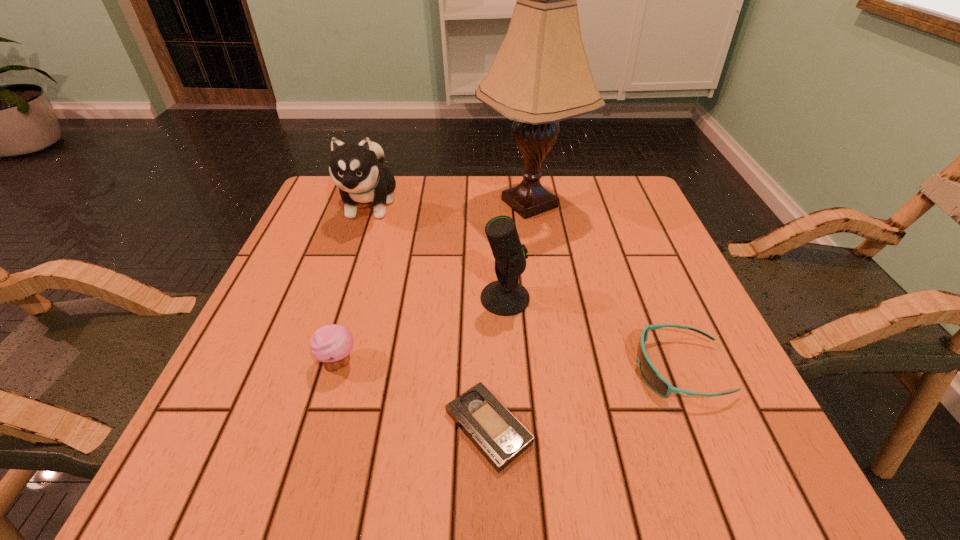
Locate an element on the screen. This screenshot has width=960, height=540. free space located 0.070m on the front-facing side of the second shortest object is located at coordinates (594, 369).

I want to click on vacant space located on the front-facing side of the second shortest object, so click(530, 369).

At what (x,y) coordinates should I click in order to perform the action: click on free space located 0.370m on the front-facing side of the second shortest object. Please return your answer as a coordinate pair (x, y). The width and height of the screenshot is (960, 540). Looking at the image, I should click on (420, 369).

Where is `vacant space situated on the left of the videotape`? The image size is (960, 540). vacant space situated on the left of the videotape is located at coordinates (406, 428).

Where is `lamp that is positioned at the far edge`? lamp that is positioned at the far edge is located at coordinates pos(541,75).

The width and height of the screenshot is (960, 540). Find the location of `puppy that is at the far edge`. puppy that is at the far edge is located at coordinates (357, 170).

Image resolution: width=960 pixels, height=540 pixels. I want to click on object that is positioned at the near edge, so click(500, 437).

Find the location of a particular element. This screenshot has width=960, height=540. puppy present at the left edge is located at coordinates (357, 170).

You are a GUI agent. You are given a task and a screenshot of the screen. Output one action in this format:
    pyautogui.click(x=<x>, y=<y>)
    Task: Click on the cupcake that is at the left edge
    The height and width of the screenshot is (540, 960).
    Given the screenshot: What is the action you would take?
    pyautogui.click(x=332, y=344)

Locate an element on the screen. The height and width of the screenshot is (540, 960). lamp present at the right edge is located at coordinates (541, 75).